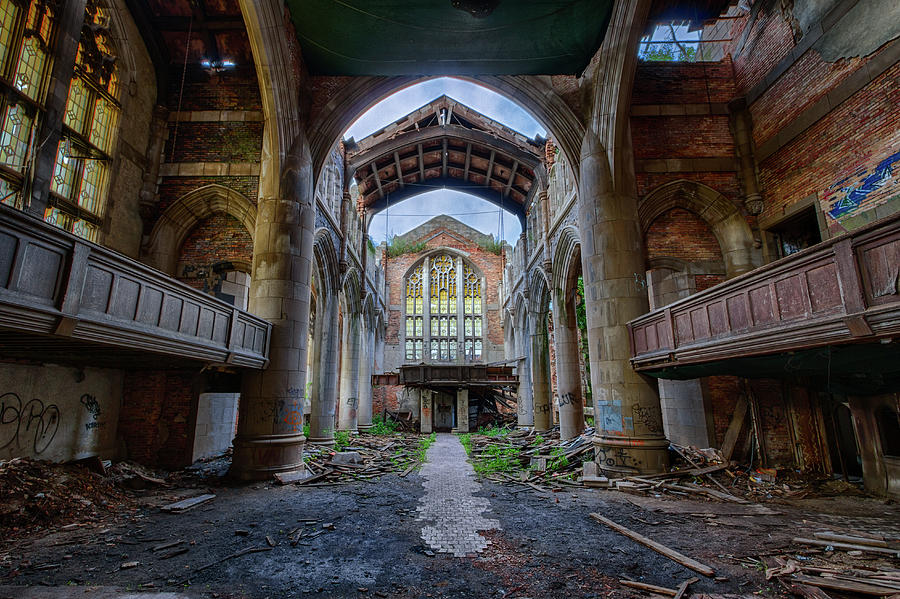
This screenshot has height=599, width=900. Identify the location of door. (442, 426).